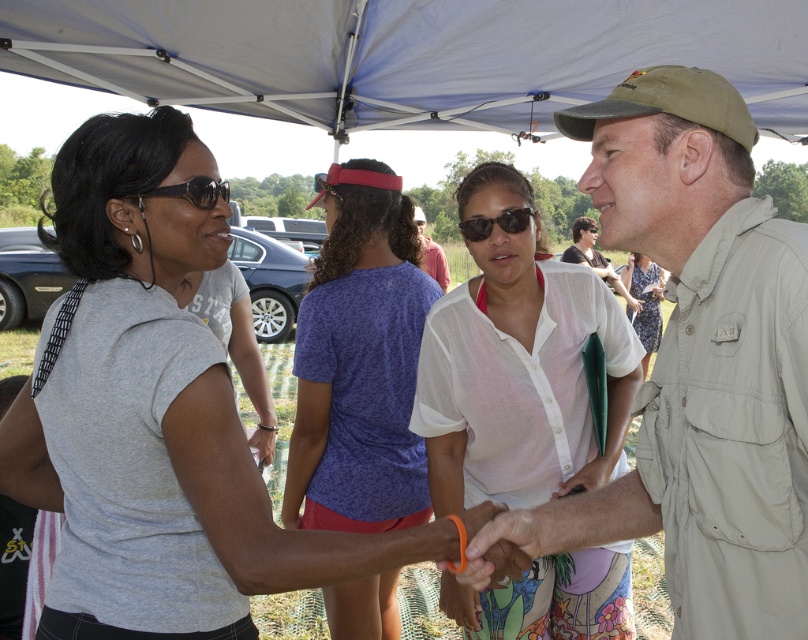
You are a photographer at the event and need to capture a photo where both the white cotton dress at center and the tan canvas hat at upper center are clearly visible. Given their height difference, which object should you position closer to the camera to ensure both are in focus?

The white cotton dress at center is taller than the tan canvas hat at upper center. To ensure both are in focus, position the white cotton dress at center closer to the camera since it is taller, allowing the tan canvas hat at upper center to still be within the focal range.

From the picture: You are a photographer at an outdoor event. You want to take a group photo of the two people wearing the white cotton dress at center and the white cotton shirt at center. The minimum distance required for your camera to focus properly is 16 inches. Do you think you can take the photo without moving either of them?

The white cotton dress at center is 15.61 inches away from the white cotton shirt at center. Since the distance is less than the required 16 inches, the camera may not focus properly. You might need to move them slightly apart to ensure proper focus.